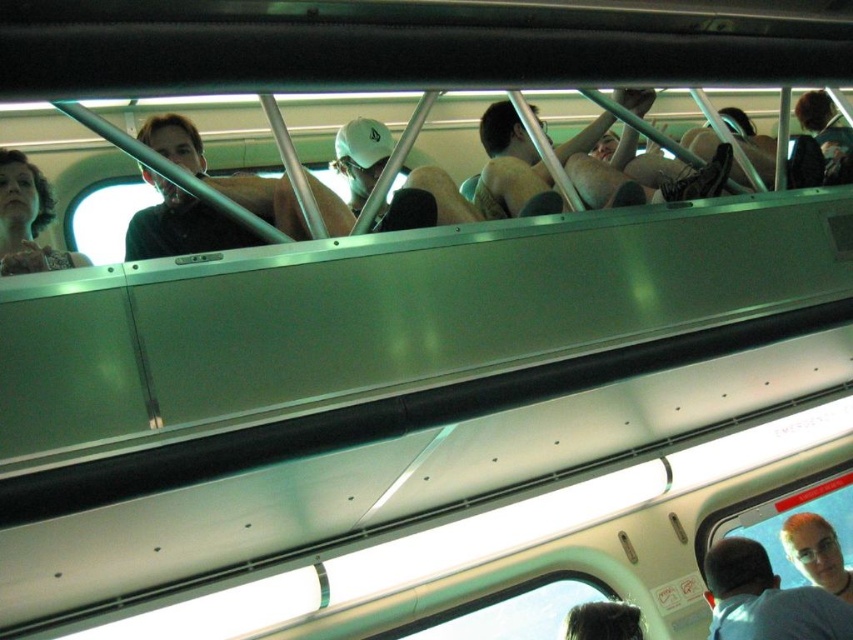
Can you confirm if matte black shirt at left is bigger than light brown hair at upper center?

Indeed, matte black shirt at left has a larger size compared to light brown hair at upper center.

Which is more to the right, matte black shirt at left or light brown hair at upper center?

From the viewer's perspective, light brown hair at upper center appears more on the right side.

Between point (258, 241) and point (815, 579), which one is positioned behind?

The point (815, 579) is behind.

In order to click on matte black shirt at left in this screenshot , I will do `click(181, 225)`.

Which is more to the left, light brown hair at lower right or light brown hair at upper center?

Positioned to the left is light brown hair at lower right.

Which is in front, point (776, 625) or point (830, 568)?

Point (776, 625) is more forward.

Measure the distance between point (811, 636) and camera.

7.90 feet

The width and height of the screenshot is (853, 640). I want to click on light brown hair at lower right, so click(766, 598).

Can you confirm if matte black hair at upper left is bigger than shiny black hair at lower center?

Yes, matte black hair at upper left is bigger than shiny black hair at lower center.

Is point (10, 237) positioned in front of point (572, 624)?

Yes.

Is point (85, 257) positioned behind point (621, 632)?

No.

Image resolution: width=853 pixels, height=640 pixels. Identify the location of matte black hair at upper left. (27, 220).